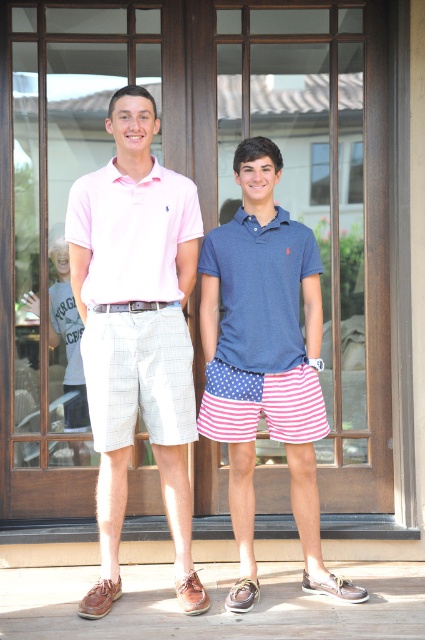
Does blue cotton polo shirt at center have a greater height compared to matte pink polo shirt at center?

Yes.

Does blue cotton polo shirt at center have a lesser height compared to matte pink polo shirt at center?

No.

Does point (300, 529) come behind point (172, 196)?

Yes, it is.

Where is `blue cotton polo shirt at center`? Image resolution: width=425 pixels, height=640 pixels. blue cotton polo shirt at center is located at coordinates 265,362.

Which of these two, pink cotton polo shirt at center or navy blue polo shirt at center, stands taller?

pink cotton polo shirt at center

Measure the distance between pink cotton polo shirt at center and camera.

pink cotton polo shirt at center and camera are 3.96 meters apart.

Between point (110, 525) and point (286, 269), which one is positioned in front?

Point (110, 525)

Where is `pink cotton polo shirt at center`? Image resolution: width=425 pixels, height=640 pixels. pink cotton polo shirt at center is located at coordinates (136, 330).

Is pink cotton polo shirt at center to the right of matte pink polo shirt at center from the viewer's perspective?

In fact, pink cotton polo shirt at center is to the left of matte pink polo shirt at center.

Does pink cotton polo shirt at center have a larger size compared to matte pink polo shirt at center?

Yes.

Between point (116, 467) and point (153, 273), which one is positioned in front?

Point (153, 273) is more forward.

The image size is (425, 640). What are the coordinates of `pink cotton polo shirt at center` in the screenshot? It's located at (136, 330).